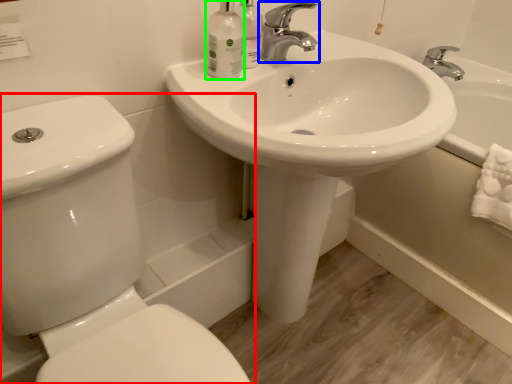
Question: Based on their relative distances, which object is farther from toilet (highlighted by a red box)? Choose from tap (highlighted by a blue box) and mouthwash (highlighted by a green box).

Choices:
 (A) tap
 (B) mouthwash

Answer: (A)